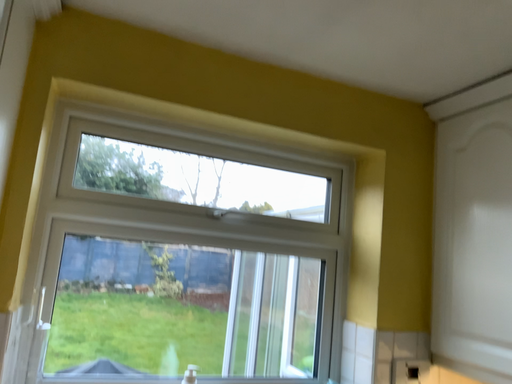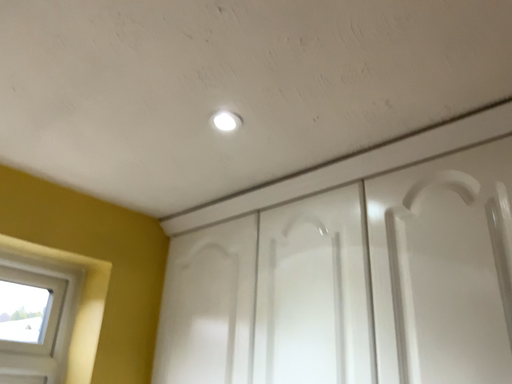
Question: How did the camera likely rotate when shooting the video?

Choices:
 (A) rotated right
 (B) rotated left

Answer: (A)